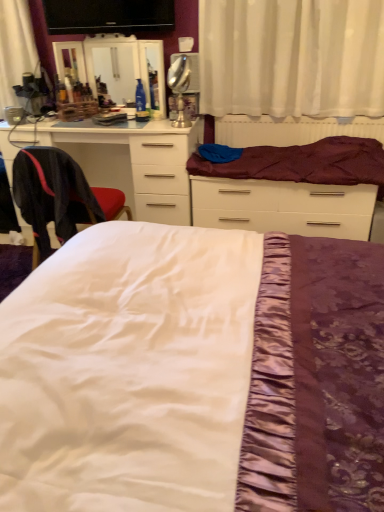
Question: Can we say maroon satin mattress at upper center lies outside white glossy chest of drawers at left?

Choices:
 (A) yes
 (B) no

Answer: (A)

Question: Are maroon satin mattress at upper center and white glossy chest of drawers at left beside each other?

Choices:
 (A) no
 (B) yes

Answer: (A)

Question: From a real-world perspective, is maroon satin mattress at upper center over white glossy chest of drawers at left?

Choices:
 (A) yes
 (B) no

Answer: (A)

Question: Considering the relative sizes of maroon satin mattress at upper center and white glossy chest of drawers at left in the image provided, is maroon satin mattress at upper center shorter than white glossy chest of drawers at left?

Choices:
 (A) yes
 (B) no

Answer: (A)

Question: Does maroon satin mattress at upper center appear on the right side of white glossy chest of drawers at left?

Choices:
 (A) no
 (B) yes

Answer: (B)

Question: Is maroon satin mattress at upper center closer to camera compared to white glossy chest of drawers at left?

Choices:
 (A) yes
 (B) no

Answer: (A)

Question: Can you confirm if white satin bed at center, marked as the first bed in a front-to-back arrangement, is taller than white glossy chest of drawers at left?

Choices:
 (A) no
 (B) yes

Answer: (B)

Question: Can white glossy chest of drawers at left be found inside white satin bed at center, marked as the first bed in a front-to-back arrangement?

Choices:
 (A) no
 (B) yes

Answer: (A)

Question: From a real-world perspective, is white satin bed at center, marked as the first bed in a front-to-back arrangement, over white glossy chest of drawers at left?

Choices:
 (A) no
 (B) yes

Answer: (B)

Question: Is the position of white satin bed at center, marked as the first bed in a front-to-back arrangement, less distant than that of white glossy chest of drawers at left?

Choices:
 (A) yes
 (B) no

Answer: (A)

Question: Considering the relative sizes of white satin bed at center, marked as the first bed in a front-to-back arrangement, and white glossy chest of drawers at left in the image provided, is white satin bed at center, marked as the first bed in a front-to-back arrangement, thinner than white glossy chest of drawers at left?

Choices:
 (A) yes
 (B) no

Answer: (B)

Question: Is white satin bed at center, which is counted as the second bed, starting from the back, directly adjacent to white glossy chest of drawers at left?

Choices:
 (A) no
 (B) yes

Answer: (A)

Question: Does silver metallic table lamp at upper center come in front of purple satin bed at center, which ranks as the second bed in front-to-back order?

Choices:
 (A) no
 (B) yes

Answer: (B)